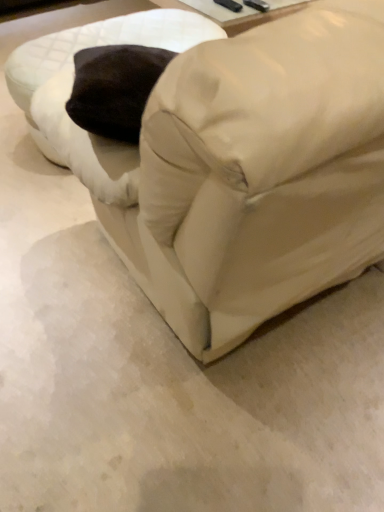
Question: Does white fabric swivel chair at upper left have a larger size compared to matte white couch at center?

Choices:
 (A) yes
 (B) no

Answer: (B)

Question: Is matte white couch at center at the back of white fabric swivel chair at upper left?

Choices:
 (A) no
 (B) yes

Answer: (B)

Question: Does white fabric swivel chair at upper left have a greater height compared to matte white couch at center?

Choices:
 (A) yes
 (B) no

Answer: (B)

Question: Does white fabric swivel chair at upper left have a lesser width compared to matte white couch at center?

Choices:
 (A) no
 (B) yes

Answer: (B)

Question: Considering the relative positions of white fabric swivel chair at upper left and matte white couch at center in the image provided, is white fabric swivel chair at upper left in front of matte white couch at center?

Choices:
 (A) no
 (B) yes

Answer: (A)

Question: Is white fabric swivel chair at upper left located outside matte white couch at center?

Choices:
 (A) no
 (B) yes

Answer: (B)

Question: Considering the relative sizes of matte white couch at center and white fabric swivel chair at upper left in the image provided, is matte white couch at center shorter than white fabric swivel chair at upper left?

Choices:
 (A) yes
 (B) no

Answer: (B)

Question: From the image's perspective, is matte white couch at center below white fabric swivel chair at upper left?

Choices:
 (A) no
 (B) yes

Answer: (B)

Question: Would you say matte white couch at center contains white fabric swivel chair at upper left?

Choices:
 (A) yes
 (B) no

Answer: (B)

Question: Is there a large distance between matte white couch at center and white fabric swivel chair at upper left?

Choices:
 (A) no
 (B) yes

Answer: (B)

Question: Is matte white couch at center closer to the viewer compared to white fabric swivel chair at upper left?

Choices:
 (A) yes
 (B) no

Answer: (A)

Question: Is matte white couch at center not inside white fabric swivel chair at upper left?

Choices:
 (A) yes
 (B) no

Answer: (A)

Question: In terms of size, does white fabric swivel chair at upper left appear bigger or smaller than matte white couch at center?

Choices:
 (A) big
 (B) small

Answer: (B)